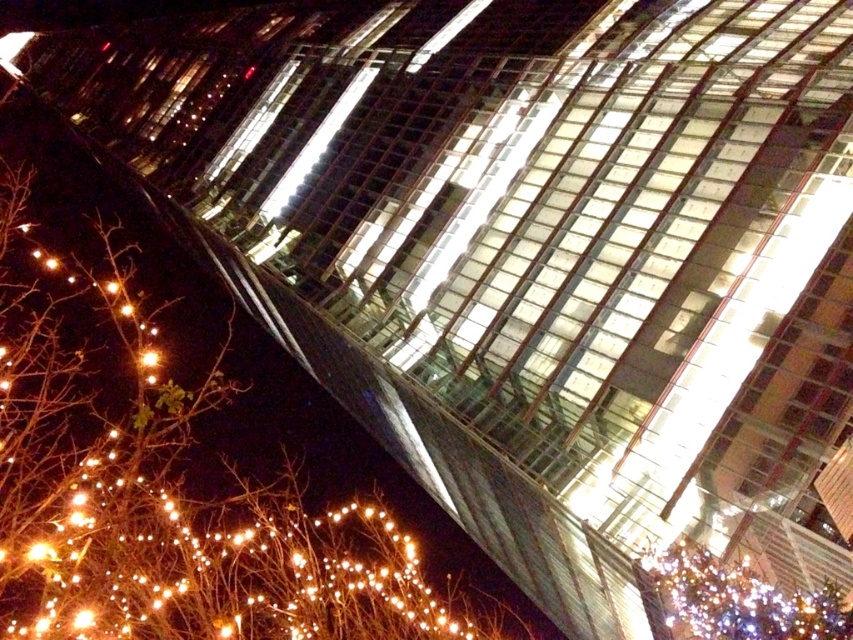
Question: From the image, what is the correct spatial relationship of shiny gold lights at lower left in relation to illuminated glass tree at lower right?

Choices:
 (A) below
 (B) above

Answer: (A)

Question: Does shiny gold lights at lower left appear under illuminated glass tree at lower right?

Choices:
 (A) no
 (B) yes

Answer: (B)

Question: Does shiny gold lights at lower left come behind illuminated glass tree at lower right?

Choices:
 (A) yes
 (B) no

Answer: (A)

Question: Which of the following is the farthest from the observer?

Choices:
 (A) (250, 584)
 (B) (705, 586)

Answer: (A)

Question: Which point is farther to the camera?

Choices:
 (A) shiny gold lights at lower left
 (B) illuminated glass tree at lower right

Answer: (A)

Question: Which point is closer to the camera?

Choices:
 (A) (810, 632)
 (B) (24, 272)

Answer: (A)